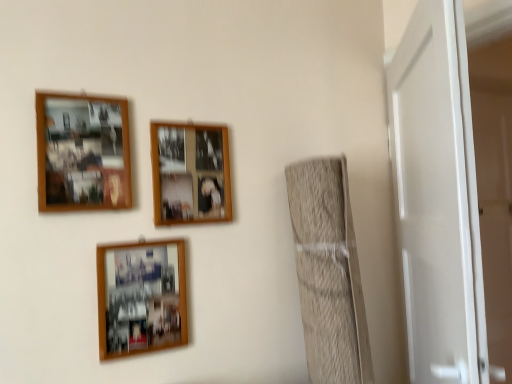
Question: Does wooden photo frame at lower center, which is the third picture frame in top-to-bottom order, come in front of woodenobject at upper center, the 2th picture frame in the bottom-to-top sequence?

Choices:
 (A) yes
 (B) no

Answer: (A)

Question: From a real-world perspective, is wooden photo frame at lower center, which is the third picture frame in top-to-bottom order, physically below woodenobject at upper center, the 2th picture frame in the bottom-to-top sequence?

Choices:
 (A) no
 (B) yes

Answer: (B)

Question: Is wooden photo frame at lower center, which appears as the first picture frame when ordered from the bottom, not inside woodenobject at upper center, the 2th picture frame in the bottom-to-top sequence?

Choices:
 (A) no
 (B) yes

Answer: (B)

Question: Would you consider wooden photo frame at lower center, which appears as the first picture frame when ordered from the bottom, to be distant from woodenobject at upper center, arranged as the 2th picture frame when viewed from the top?

Choices:
 (A) no
 (B) yes

Answer: (A)

Question: Considering the relative sizes of wooden photo frame at lower center, which is the third picture frame in top-to-bottom order, and woodenobject at upper center, arranged as the 2th picture frame when viewed from the top, in the image provided, is wooden photo frame at lower center, which is the third picture frame in top-to-bottom order, wider than woodenobject at upper center, arranged as the 2th picture frame when viewed from the top,?

Choices:
 (A) yes
 (B) no

Answer: (A)

Question: Is woodenobject at upper center, arranged as the 2th picture frame when viewed from the top, a part of wooden photo frame at lower center, which appears as the first picture frame when ordered from the bottom?

Choices:
 (A) yes
 (B) no

Answer: (B)

Question: Is wooden photo frame at upper left, acting as the 1th picture frame starting from the top, positioned in front of white glossy door at right?

Choices:
 (A) no
 (B) yes

Answer: (A)

Question: From the image's perspective, is wooden photo frame at upper left, positioned as the 3th picture frame in bottom-to-top order, beneath white glossy door at right?

Choices:
 (A) yes
 (B) no

Answer: (B)

Question: Is wooden photo frame at upper left, positioned as the 3th picture frame in bottom-to-top order, not inside white glossy door at right?

Choices:
 (A) yes
 (B) no

Answer: (A)

Question: From a real-world perspective, does wooden photo frame at upper left, acting as the 1th picture frame starting from the top, stand above white glossy door at right?

Choices:
 (A) no
 (B) yes

Answer: (B)

Question: Is wooden photo frame at upper left, acting as the 1th picture frame starting from the top, facing towards white glossy door at right?

Choices:
 (A) yes
 (B) no

Answer: (B)

Question: From a real-world perspective, is wooden photo frame at upper left, positioned as the 3th picture frame in bottom-to-top order, beneath wooden photo frame at lower center, which appears as the first picture frame when ordered from the bottom?

Choices:
 (A) no
 (B) yes

Answer: (A)